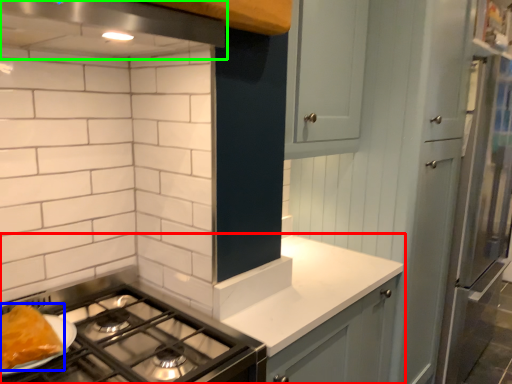
Question: Estimate the real-world distances between objects in this image. Which object is farther from countertop (highlighted by a red box), food (highlighted by a blue box) or exhaust hood (highlighted by a green box)?

Choices:
 (A) food
 (B) exhaust hood

Answer: (B)